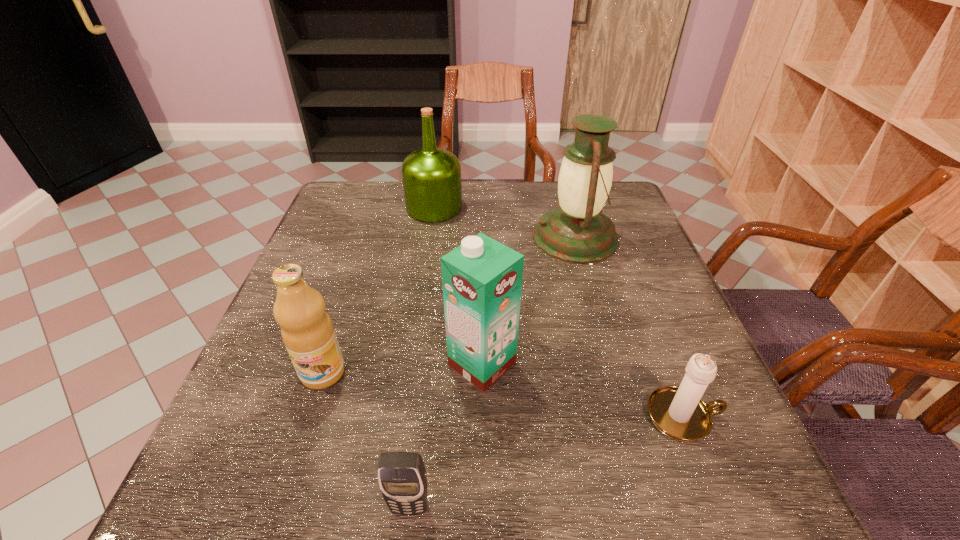
Identify the location of free space located on the front of the right olive oil. (427, 255).

Find the location of `vacant region located on the left of the carton`. vacant region located on the left of the carton is located at coordinates (287, 364).

The image size is (960, 540). I want to click on free location located 0.060m on the label of the leftmost object, so click(307, 421).

Where is `lantern located at the far edge`? Image resolution: width=960 pixels, height=540 pixels. lantern located at the far edge is located at coordinates (576, 231).

At what (x,y) coordinates should I click in order to perform the action: click on olive oil positioned at the far edge. Please return your answer as a coordinate pair (x, y). Looking at the image, I should click on (431, 176).

In order to click on object that is at the near edge in this screenshot , I will do `click(402, 478)`.

The image size is (960, 540). Find the location of `object situated at the left edge`. object situated at the left edge is located at coordinates (307, 331).

Identify the location of lantern present at the right edge. (576, 231).

Find the location of `candle holder that is at the right edge`. candle holder that is at the right edge is located at coordinates [679, 413].

The width and height of the screenshot is (960, 540). Find the location of `object that is at the far right corner`. object that is at the far right corner is located at coordinates (576, 231).